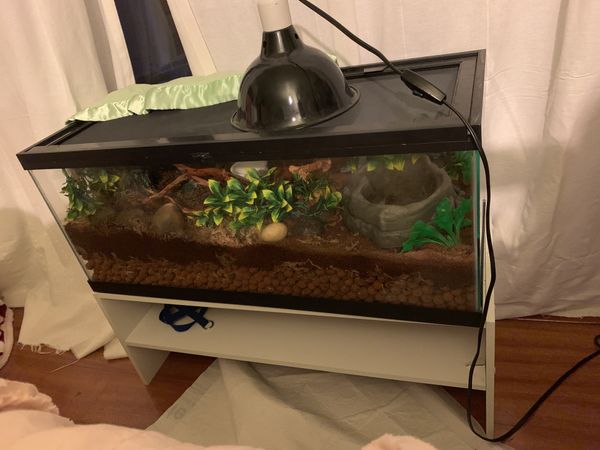
This screenshot has height=450, width=600. In order to click on aquarium in this screenshot , I will do `click(356, 259)`.